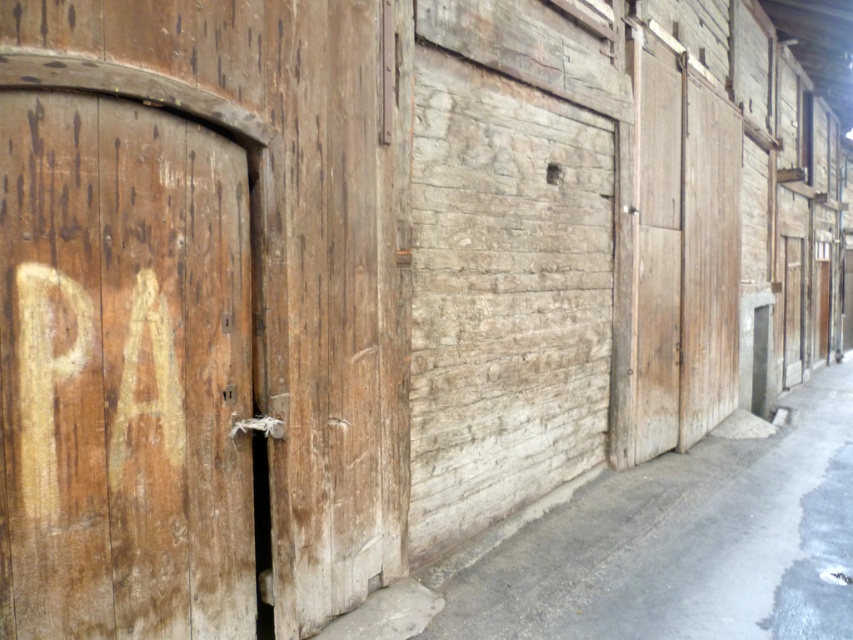
You are a delivery person trying to enter the building. You see two wooden doors, the wooden door at left and the wooden door at center. Which door is larger and more suitable for carrying a large package?

The wooden door at center is larger than the wooden door at left, so it is more suitable for carrying a large package.

You are standing in front of the wooden building and want to enter through one of the doors. Which door, the wooden door at left or the wooden door at center, is closer to you?

The wooden door at left is closer to the viewer than the wooden door at center, so the wooden door at left is closer to you.

You are standing in front of the wooden building and see the wooden door at left and the wooden door at center. Which door is positioned lower in the structure?

The wooden door at left is positioned lower than the wooden door at center.